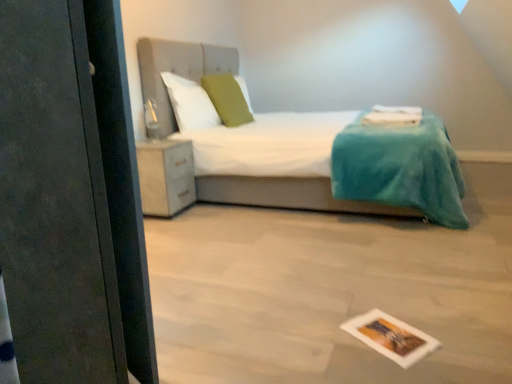
Question: Considering the relative sizes of matte white cabinet at lower left and white fabric bed at center in the image provided, is matte white cabinet at lower left thinner than white fabric bed at center?

Choices:
 (A) yes
 (B) no

Answer: (A)

Question: Is matte white cabinet at lower left positioned with its back to white fabric bed at center?

Choices:
 (A) yes
 (B) no

Answer: (B)

Question: Does matte white cabinet at lower left touch white fabric bed at center?

Choices:
 (A) no
 (B) yes

Answer: (A)

Question: Can you confirm if matte white cabinet at lower left is smaller than white fabric bed at center?

Choices:
 (A) no
 (B) yes

Answer: (B)

Question: Can we say matte white cabinet at lower left lies outside white fabric bed at center?

Choices:
 (A) no
 (B) yes

Answer: (A)

Question: From the image's perspective, is green fabric pillow at center, the 2th pillow in the left-to-right sequence, positioned above or below printed paper postcard at lower center?

Choices:
 (A) above
 (B) below

Answer: (A)

Question: Considering the positions of green fabric pillow at center, the 2th pillow in the left-to-right sequence, and printed paper postcard at lower center in the image, is green fabric pillow at center, the 2th pillow in the left-to-right sequence, taller or shorter than printed paper postcard at lower center?

Choices:
 (A) short
 (B) tall

Answer: (B)

Question: From a real-world perspective, relative to printed paper postcard at lower center, is green fabric pillow at center, the 2th pillow in the left-to-right sequence, vertically above or below?

Choices:
 (A) above
 (B) below

Answer: (A)

Question: Considering their positions, is green fabric pillow at center, the 2th pillow in the left-to-right sequence, located in front of or behind printed paper postcard at lower center?

Choices:
 (A) front
 (B) behind

Answer: (B)

Question: Is matte white cabinet at lower left wider or thinner than white fabric bed at center?

Choices:
 (A) wide
 (B) thin

Answer: (B)

Question: In terms of size, does matte white cabinet at lower left appear bigger or smaller than white fabric bed at center?

Choices:
 (A) small
 (B) big

Answer: (A)

Question: From a real-world perspective, relative to white fabric bed at center, is matte white cabinet at lower left vertically above or below?

Choices:
 (A) above
 (B) below

Answer: (B)

Question: From the image's perspective, relative to white fabric bed at center, is matte white cabinet at lower left above or below?

Choices:
 (A) above
 (B) below

Answer: (B)

Question: From the image's perspective, relative to white soft pillow at upper center, which is the second pillow in right-to-left order, is green fabric pillow at center, the 1th pillow positioned from the right, above or below?

Choices:
 (A) below
 (B) above

Answer: (B)

Question: Is point (244, 112) positioned closer to the camera than point (193, 127)?

Choices:
 (A) farther
 (B) closer

Answer: (A)